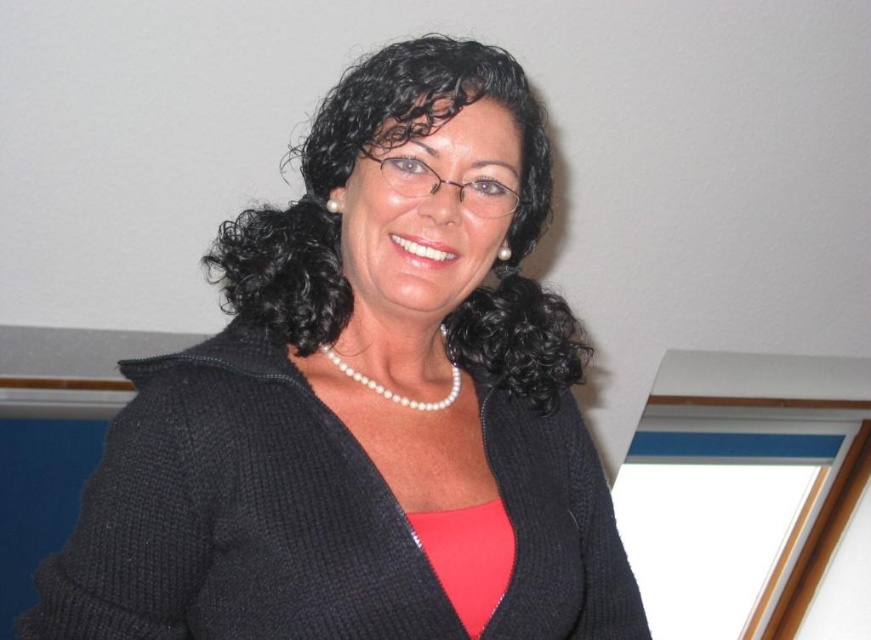
Is black knitted sweater at center below pearl necklace at center?

Actually, black knitted sweater at center is above pearl necklace at center.

Which is behind, point (279, 387) or point (363, 381)?

Point (363, 381)

Which is behind, point (288, 296) or point (451, 400)?

The point (451, 400) is behind.

Locate an element on the screen. black knitted sweater at center is located at coordinates (365, 403).

Does black curly hair at center appear on the left side of pearl necklace at center?

Indeed, black curly hair at center is positioned on the left side of pearl necklace at center.

Does black curly hair at center have a greater width compared to pearl necklace at center?

Yes, black curly hair at center is wider than pearl necklace at center.

Does point (356, 104) lie behind point (323, 346)?

No.

The width and height of the screenshot is (871, 640). Identify the location of black curly hair at center. (341, 221).

Between black knitted sweater at center and black curly hair at center, which one has less height?

Standing shorter between the two is black curly hair at center.

Is black knitted sweater at center positioned behind black curly hair at center?

No.

Does point (246, 465) come behind point (564, 326)?

No, it is in front of (564, 326).

In order to click on black knitted sweater at center in this screenshot , I will do `click(365, 403)`.